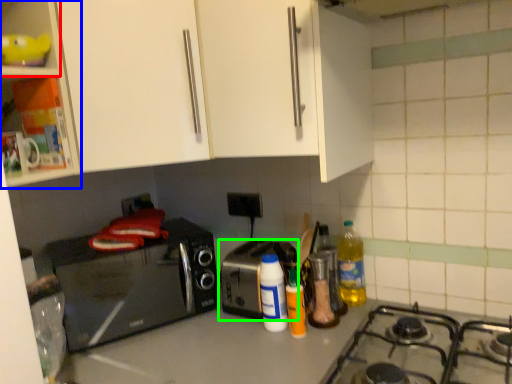
Question: Considering the real-world distances, which object is farthest from shelf (highlighted by a red box)? cabinetry (highlighted by a blue box) or toaster (highlighted by a green box)?

Choices:
 (A) cabinetry
 (B) toaster

Answer: (B)